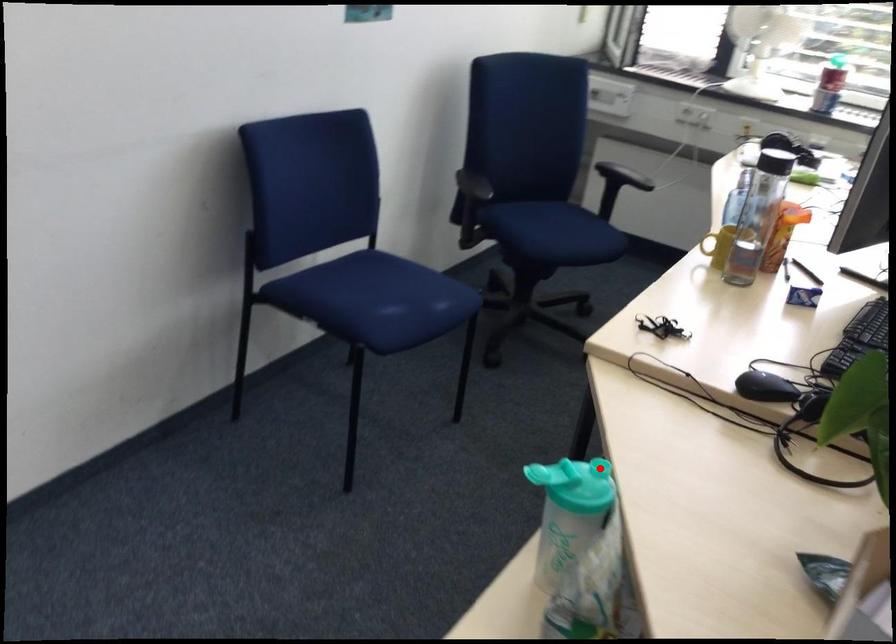
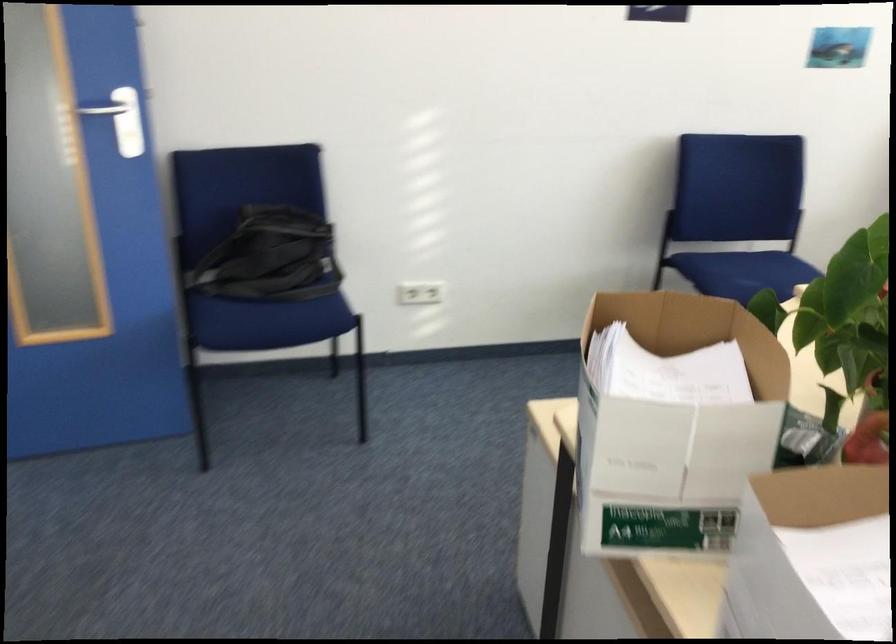
Question: I am providing you with two images of the same scene from different viewpoints. A red point is marked on the first image. Is the red point's position out of view in image 2?

Choices:
 (A) Yes
 (B) No

Answer: (A)